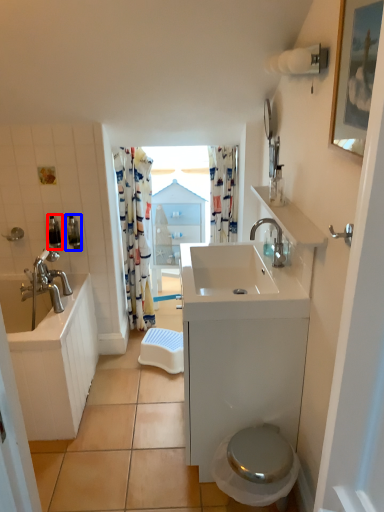
Question: Which object appears closest to the camera in this image, toiletry (highlighted by a red box) or toiletry (highlighted by a blue box)?

Choices:
 (A) toiletry
 (B) toiletry

Answer: (A)